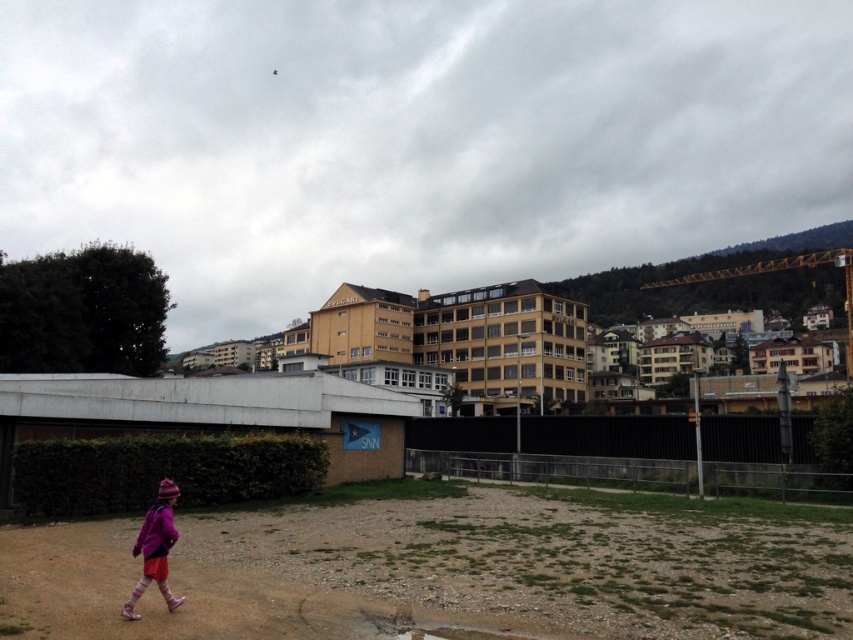
Question: Can you confirm if brown gravel field at lower left is smaller than pink woolen hat at lower left?

Choices:
 (A) no
 (B) yes

Answer: (A)

Question: Which point is farther to the camera?

Choices:
 (A) pink woolen hat at lower left
 (B) white concrete overpass at center
 (C) brown gravel field at lower left

Answer: (B)

Question: Which of the following is the farthest from the observer?

Choices:
 (A) (683, 531)
 (B) (71, 410)

Answer: (B)

Question: Where is white concrete overpass at center located in relation to pink woolen hat at lower left in the image?

Choices:
 (A) below
 (B) above

Answer: (B)

Question: Which object is farther from the camera taking this photo?

Choices:
 (A) pink woolen hat at lower left
 (B) brown gravel field at lower left
 (C) white concrete overpass at center

Answer: (C)

Question: Is brown gravel field at lower left further to camera compared to white concrete overpass at center?

Choices:
 (A) yes
 (B) no

Answer: (B)